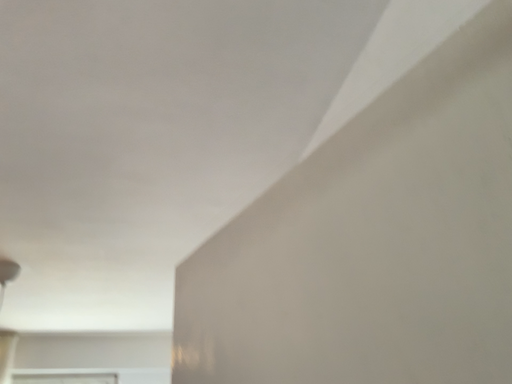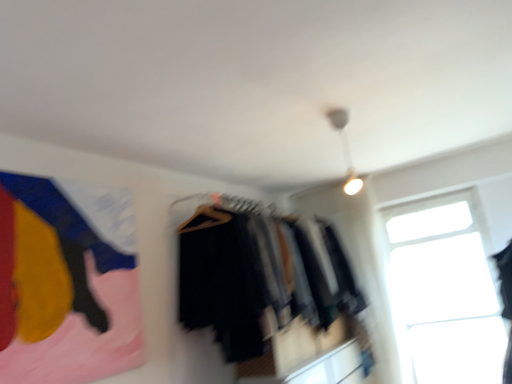
Question: Which way did the camera rotate in the video?

Choices:
 (A) rotated right
 (B) rotated left

Answer: (B)